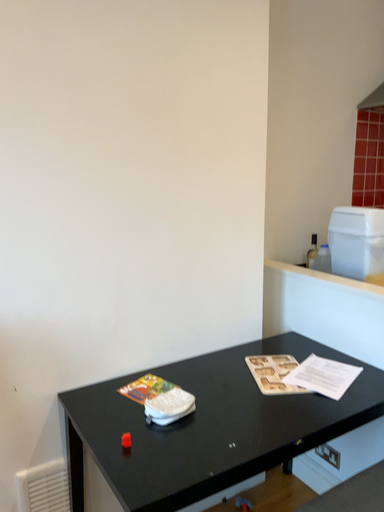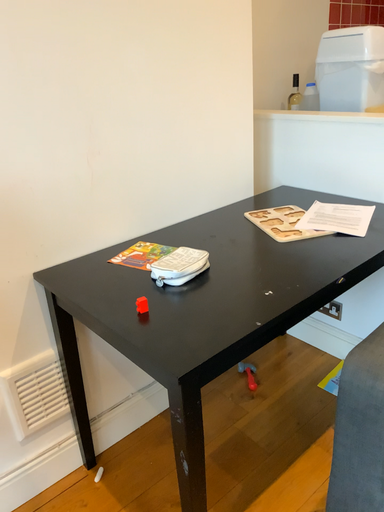
Question: How did the camera likely rotate when shooting the video?

Choices:
 (A) rotated left
 (B) rotated right

Answer: (B)